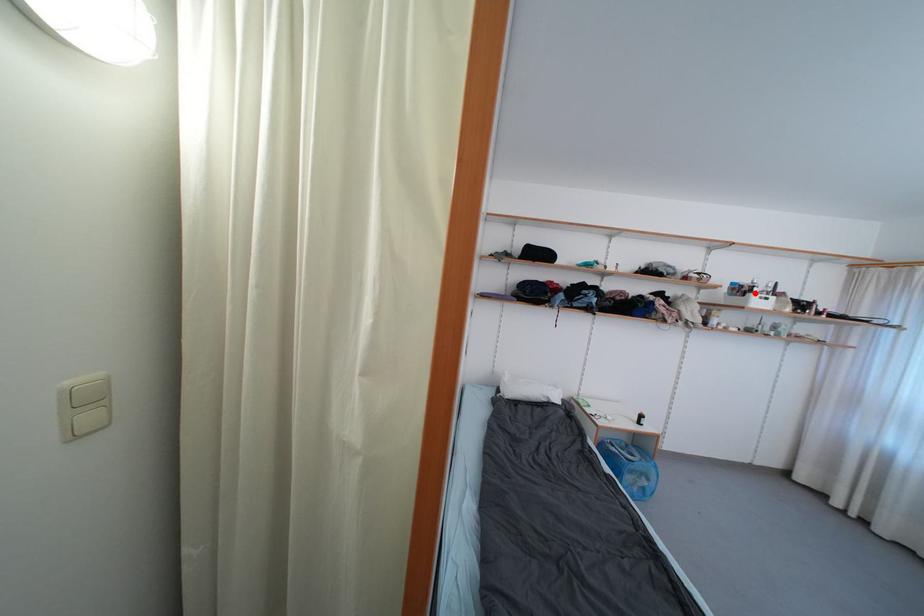
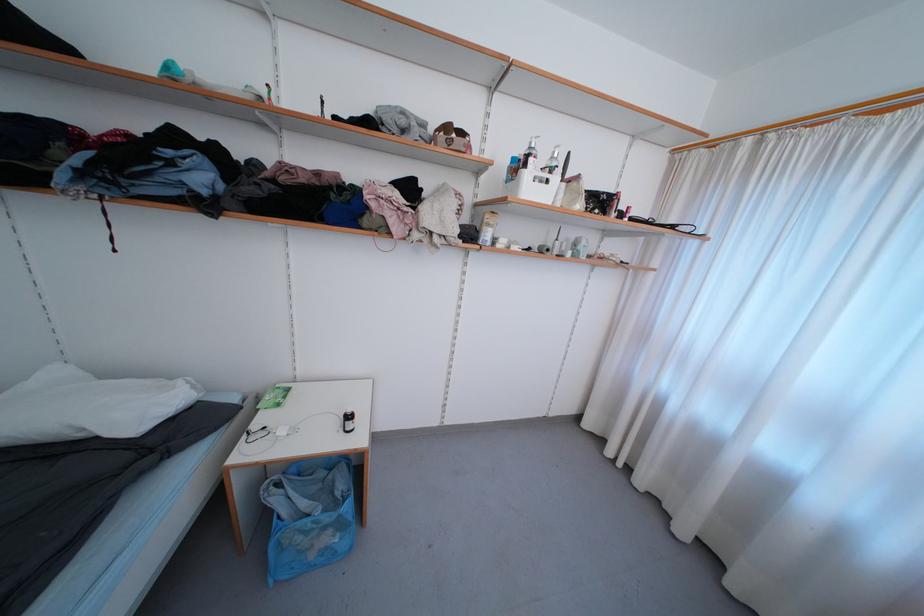
Where in the second image is the point corresponding to the highlighted location from the first image?

(529, 168)